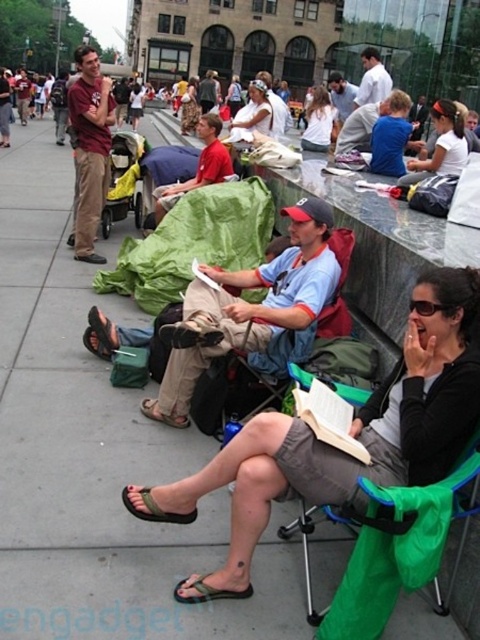
You are a photographer standing in the plaza and want to take a photo of the green fabric chair at center and the green fabric sandal at lower center. Which object should you focus on first if you want to capture both in the same frame without moving the camera?

You should focus on the green fabric chair at center first because it is much taller than the green fabric sandal at lower center, so it will be easier to ensure it fits in the frame while also including the smaller sandal.

What object is located at the coordinates point [337,285] in the image?

The point [337,285] indicates the green fabric chair at center.

You are standing in the plaza and see the green fabric chair at center and the green fabric sandal at lower center. Which object is positioned more to the right side of the plaza?

The green fabric chair at center is positioned to the right of the green fabric sandal at lower center, so the green fabric chair at center is more to the right side of the plaza.